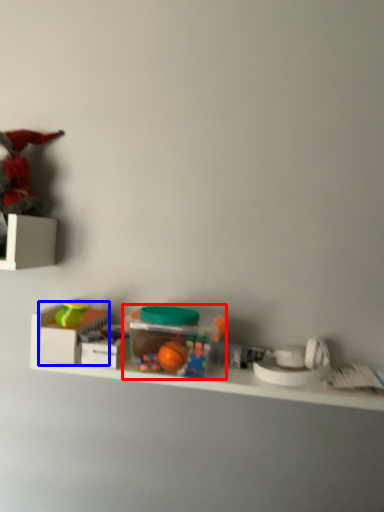
Question: Among these objects, which one is farthest to the camera, toy (highlighted by a red box) or storage box (highlighted by a blue box)?

Choices:
 (A) toy
 (B) storage box

Answer: (B)